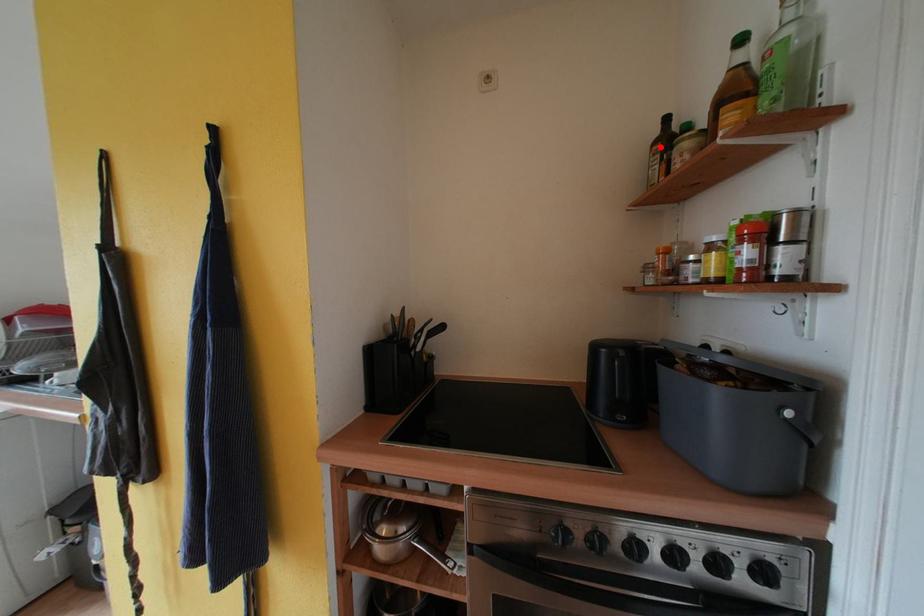
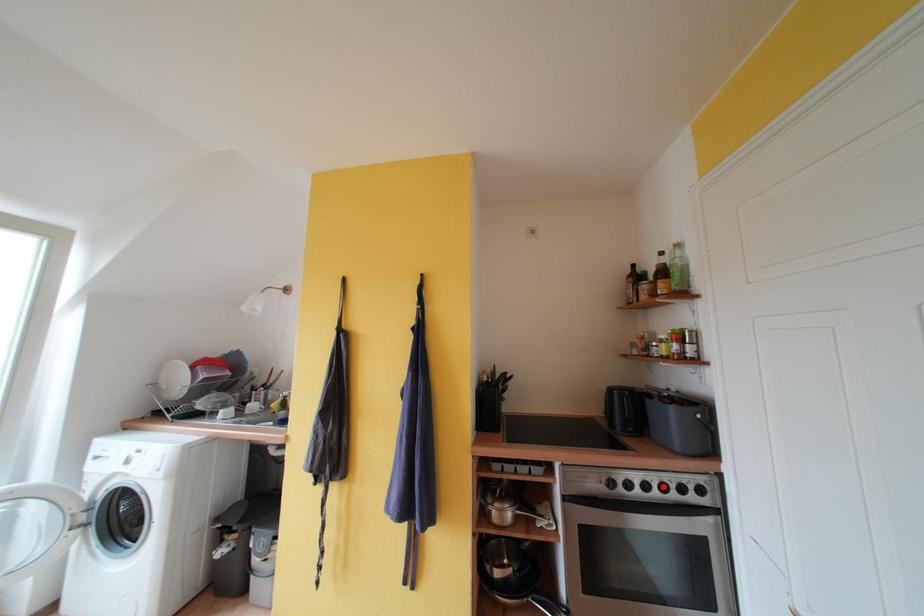
I am providing you with two images of the same scene from different viewpoints. A red point is marked on the first image and another point is marked on the second image. Is the marked point in image1 the same physical position as the marked point in image2?

No